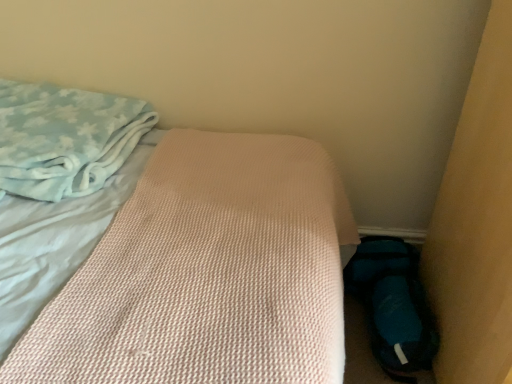
The width and height of the screenshot is (512, 384). What do you see at coordinates (65, 138) in the screenshot? I see `light blue plush blanket at upper left` at bounding box center [65, 138].

Measure the distance between point (307, 379) and camera.

65.60 centimeters.

The height and width of the screenshot is (384, 512). What do you see at coordinates (207, 274) in the screenshot?
I see `pink textured mattress at center` at bounding box center [207, 274].

You are a GUI agent. You are given a task and a screenshot of the screen. Output one action in this format:
    pyautogui.click(x=<x>, y=<y>)
    Task: Click on the blue fabric shoe at lower right
    
    Given the screenshot: What is the action you would take?
    pyautogui.click(x=393, y=305)

Considering the relative positions of pink textured mattress at center and light blue plush blanket at upper left in the image provided, is pink textured mattress at center to the right of light blue plush blanket at upper left from the viewer's perspective?

Indeed, pink textured mattress at center is positioned on the right side of light blue plush blanket at upper left.

Is pink textured mattress at center closer to camera compared to light blue plush blanket at upper left?

Yes, it is in front of light blue plush blanket at upper left.

How much distance is there between pink textured mattress at center and light blue plush blanket at upper left?

A distance of 6.95 inches exists between pink textured mattress at center and light blue plush blanket at upper left.

In terms of height, does pink textured mattress at center look taller or shorter compared to blue fabric shoe at lower right?

In the image, pink textured mattress at center appears to be taller than blue fabric shoe at lower right.

From a real-world perspective, is pink textured mattress at center positioned under blue fabric shoe at lower right based on gravity?

Actually, pink textured mattress at center is physically above blue fabric shoe at lower right in the real world.

Does point (5, 90) come behind point (372, 324)?

Yes, point (5, 90) is farther from viewer.

Considering the relative sizes of pink textured mattress at center and blue fabric shoe at lower right in the image provided, is pink textured mattress at center thinner than blue fabric shoe at lower right?

No.

Which is nearer, [9,155] or [362,267]?

Point [9,155] is positioned closer to the camera compared to point [362,267].

How distant is light blue plush blanket at upper left from blue fabric shoe at lower right?

38.96 inches.

Based on the photo, from a real-world perspective, is light blue plush blanket at upper left below blue fabric shoe at lower right?

Actually, light blue plush blanket at upper left is physically above blue fabric shoe at lower right in the real world.

Is blue fabric shoe at lower right at the back of light blue plush blanket at upper left?

No, light blue plush blanket at upper left is not facing away from blue fabric shoe at lower right.

Is light blue plush blanket at upper left outside of pink textured mattress at center?

No, light blue plush blanket at upper left is inside pink textured mattress at center's boundary.

Is point (138, 128) positioned before point (283, 279)?

No, (138, 128) is further to viewer.

In the scene shown: Is light blue plush blanket at upper left thinner than pink textured mattress at center?

Yes.

I want to click on bed below the light blue plush blanket at upper left (from the image's perspective), so point(207,274).

You are a GUI agent. You are given a task and a screenshot of the screen. Output one action in this format:
    pyautogui.click(x=<x>, y=<y>)
    Task: Click on the footwear below the light blue plush blanket at upper left (from a real-world perspective)
    The height and width of the screenshot is (384, 512).
    Given the screenshot: What is the action you would take?
    pyautogui.click(x=393, y=305)

Does point (361, 293) appear closer or farther from the camera than point (131, 121)?

Point (361, 293) appears to be farther away from the viewer than point (131, 121).

Considering the relative positions of blue fabric shoe at lower right and light blue plush blanket at upper left in the image provided, is blue fabric shoe at lower right to the left or to the right of light blue plush blanket at upper left?

In the image, blue fabric shoe at lower right appears on the right side of light blue plush blanket at upper left.

Is blue fabric shoe at lower right not near light blue plush blanket at upper left?

blue fabric shoe at lower right is near light blue plush blanket at upper left, not far away.

In the scene shown: Who is taller, blue fabric shoe at lower right or pink textured mattress at center?

With more height is pink textured mattress at center.

Which is correct: blue fabric shoe at lower right is inside pink textured mattress at center, or outside of it?

blue fabric shoe at lower right cannot be found inside pink textured mattress at center.

Considering the sizes of objects blue fabric shoe at lower right and pink textured mattress at center in the image provided, who is wider, blue fabric shoe at lower right or pink textured mattress at center?

pink textured mattress at center is wider.

Find the location of a particular element. The height and width of the screenshot is (384, 512). cloth lying behind the pink textured mattress at center is located at coordinates (65, 138).

Where is `bed above the blue fabric shoe at lower right (from the image's perspective)`? bed above the blue fabric shoe at lower right (from the image's perspective) is located at coordinates (207, 274).

Based on their spatial positions, is blue fabric shoe at lower right or light blue plush blanket at upper left closer to pink textured mattress at center?

light blue plush blanket at upper left lies closer to pink textured mattress at center than the other object.

Looking at the image, which one is located closer to light blue plush blanket at upper left, pink textured mattress at center or blue fabric shoe at lower right?

pink textured mattress at center is positioned closer to the anchor light blue plush blanket at upper left.

Considering their positions, is light blue plush blanket at upper left positioned closer to pink textured mattress at center than blue fabric shoe at lower right?

The object closer to pink textured mattress at center is light blue plush blanket at upper left.

Considering their positions, is light blue plush blanket at upper left positioned closer to blue fabric shoe at lower right than pink textured mattress at center?

pink textured mattress at center.

Based on the photo, from the image, which object appears to be farther from light blue plush blanket at upper left, blue fabric shoe at lower right or pink textured mattress at center?

The object further to light blue plush blanket at upper left is blue fabric shoe at lower right.

Considering their positions, is pink textured mattress at center positioned closer to blue fabric shoe at lower right than light blue plush blanket at upper left?

pink textured mattress at center lies closer to blue fabric shoe at lower right than the other object.

Locate an element on the screen. bed between light blue plush blanket at upper left and blue fabric shoe at lower right is located at coordinates (207, 274).